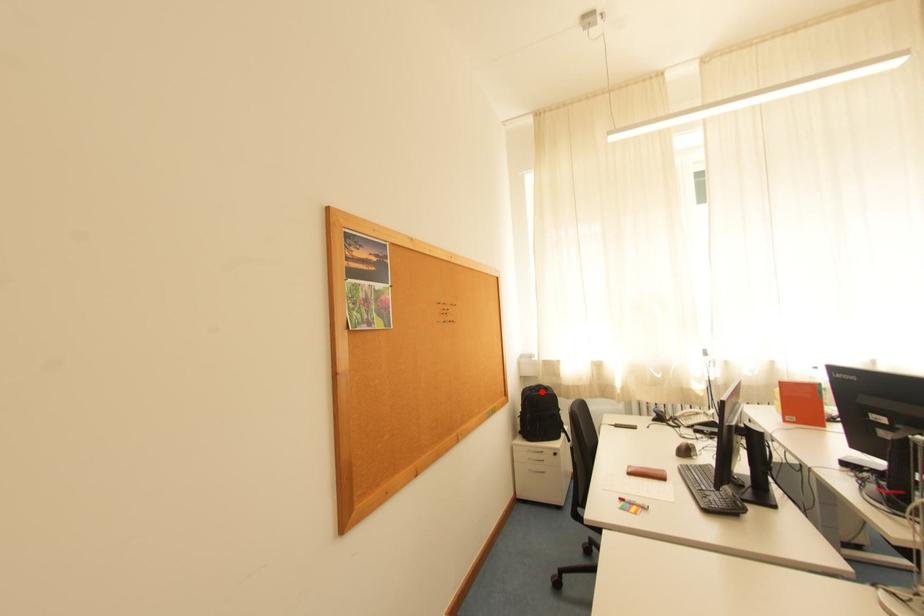
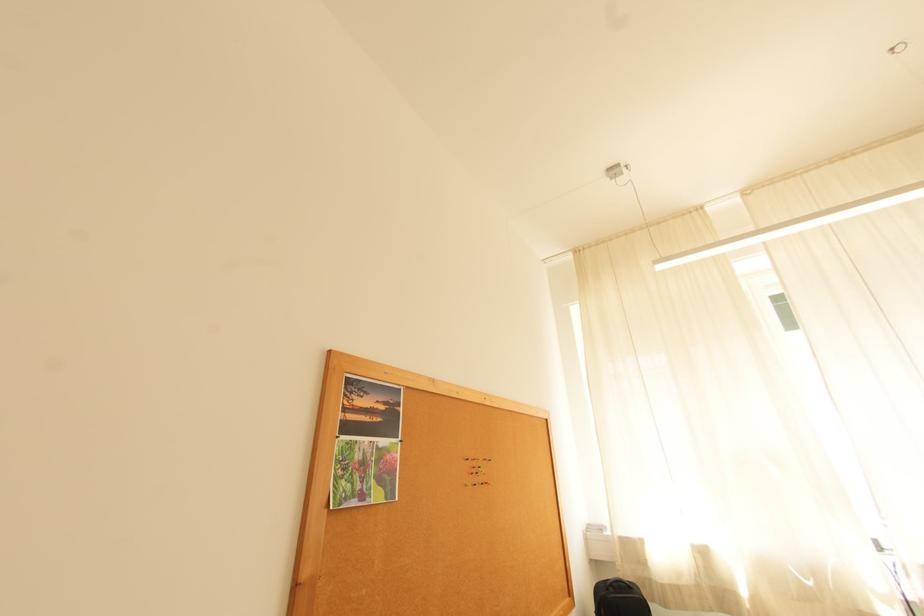
Question: I am providing you with two images of the same scene from different viewpoints. In image1, a red point is highlighted. Considering the same 3D point in image2, which of the following is correct?

Choices:
 (A) It is closer
 (B) It is farther

Answer: (A)